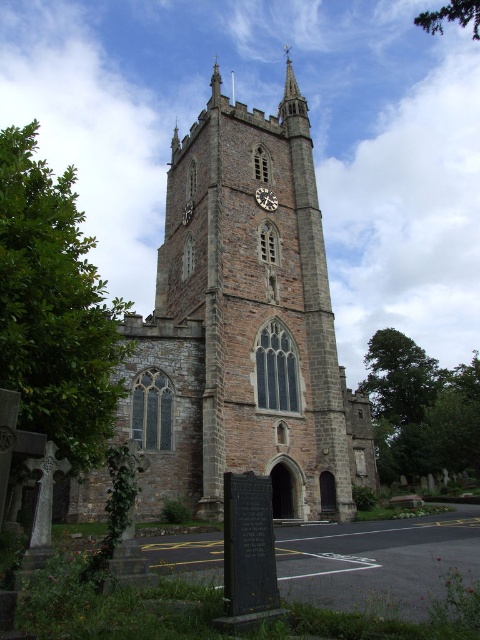
Between stone church at center and dark gray stone clock at center, which one has more height?

With more height is stone church at center.

Does point (252, 257) come farther from viewer compared to point (268, 195)?

No.

Identify the location of stone church at center. (243, 326).